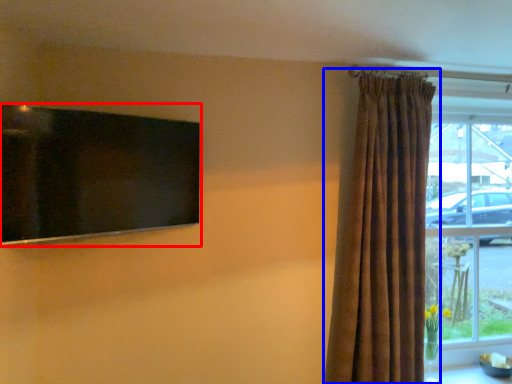
Question: Which object is closer to the camera taking this photo, window screen (highlighted by a red box) or curtain (highlighted by a blue box)?

Choices:
 (A) window screen
 (B) curtain

Answer: (A)